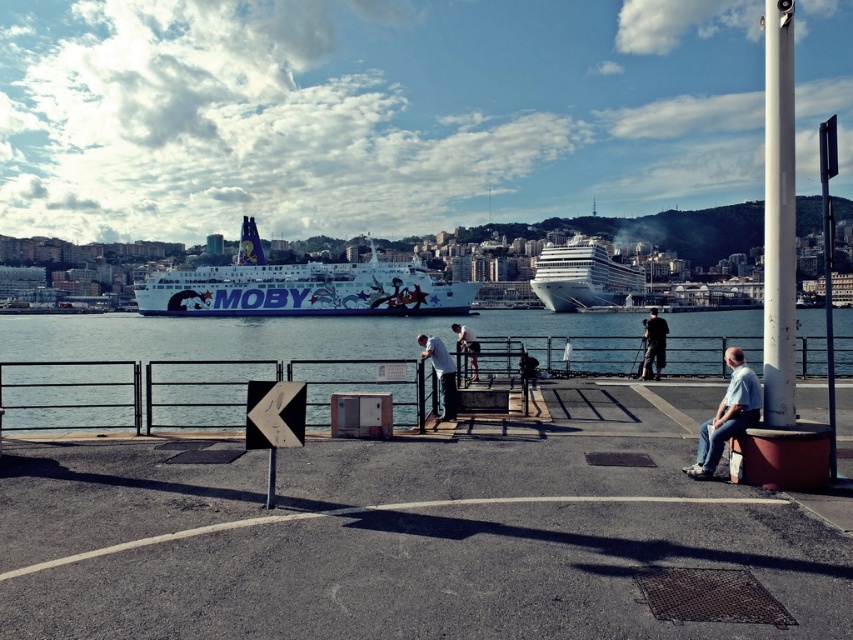
Does white glossy cruise ship at center have a greater width compared to light blue denim jeans at lower right?

Yes.

Between point (540, 260) and point (746, 416), which one is positioned behind?

Positioned behind is point (540, 260).

Where is `white glossy cruise ship at center`? This screenshot has height=640, width=853. white glossy cruise ship at center is located at coordinates (583, 275).

Can you confirm if white glossy ferry at center is positioned to the right of light blue denim jeans at lower right?

In fact, white glossy ferry at center is to the left of light blue denim jeans at lower right.

Between white glossy ferry at center and light blue denim jeans at lower right, which one has less height?

With less height is light blue denim jeans at lower right.

Describe the element at coordinates (300, 288) in the screenshot. I see `white glossy ferry at center` at that location.

The width and height of the screenshot is (853, 640). In order to click on white glossy ferry at center in this screenshot , I will do `click(300, 288)`.

In the scene shown: Can you confirm if clear blue water at center is positioned below white glossy ferry at center?

Indeed, clear blue water at center is positioned under white glossy ferry at center.

The image size is (853, 640). What are the coordinates of `clear blue water at center` in the screenshot? It's located at (270, 333).

Locate an element on the screen. The height and width of the screenshot is (640, 853). clear blue water at center is located at coordinates (270, 333).